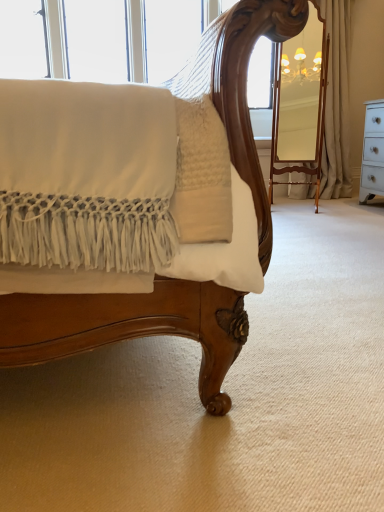
Measure the distance between beige fabric curtain at upper right, the second curtain when ordered from right to left, and camera.

beige fabric curtain at upper right, the second curtain when ordered from right to left, is 3.27 meters away from camera.

You are a GUI agent. You are given a task and a screenshot of the screen. Output one action in this format:
    pyautogui.click(x=<x>, y=<y>)
    Task: Click on the beige fabric curtain at upper right, the 1th curtain positioned from the left
    
    Given the screenshot: What is the action you would take?
    pyautogui.click(x=337, y=102)

Describe the element at coordinates (337, 102) in the screenshot. I see `beige fabric curtain at upper right, the 1th curtain positioned from the left` at that location.

Measure the distance between beige fabric curtain at right, marked as the first curtain in a right-to-left arrangement, and camera.

beige fabric curtain at right, marked as the first curtain in a right-to-left arrangement, is 3.72 meters from camera.

Locate an element on the screen. beige fabric curtain at right, marked as the first curtain in a right-to-left arrangement is located at coordinates (337, 103).

Image resolution: width=384 pixels, height=512 pixels. Describe the element at coordinates (337, 103) in the screenshot. I see `beige fabric curtain at right, marked as the first curtain in a right-to-left arrangement` at that location.

You are a GUI agent. You are given a task and a screenshot of the screen. Output one action in this format:
    pyautogui.click(x=<x>, y=<y>)
    Task: Click on the beige fabric curtain at upper right, the second curtain when ordered from right to left
    
    Given the screenshot: What is the action you would take?
    pyautogui.click(x=337, y=102)

Is beige fabric curtain at upper right, the 1th curtain positioned from the left, to the left or to the right of beige fabric curtain at right, the second curtain when ordered from left to right, in the image?

beige fabric curtain at upper right, the 1th curtain positioned from the left, is positioned on beige fabric curtain at right, the second curtain when ordered from left to right,'s left side.

Which is behind, beige fabric curtain at upper right, the second curtain when ordered from right to left, or beige fabric curtain at right, the second curtain when ordered from left to right?

beige fabric curtain at right, the second curtain when ordered from left to right, is further from the camera.

Does point (338, 12) come farther from viewer compared to point (332, 40)?

Yes, point (338, 12) is behind point (332, 40).

From the image's perspective, who appears lower, beige fabric curtain at upper right, the 1th curtain positioned from the left, or beige fabric curtain at right, the second curtain when ordered from left to right?

beige fabric curtain at upper right, the 1th curtain positioned from the left, is shown below in the image.

From a real-world perspective, which object stands above the other?

beige fabric curtain at right, marked as the first curtain in a right-to-left arrangement, from a real-world perspective.

Between beige fabric curtain at upper right, the 1th curtain positioned from the left, and beige fabric curtain at right, marked as the first curtain in a right-to-left arrangement, which one has larger width?

With larger width is beige fabric curtain at upper right, the 1th curtain positioned from the left.

Does beige fabric curtain at upper right, the 1th curtain positioned from the left, have a greater height compared to beige fabric curtain at right, marked as the first curtain in a right-to-left arrangement?

No.

Between beige fabric curtain at upper right, the 1th curtain positioned from the left, and beige fabric curtain at right, marked as the first curtain in a right-to-left arrangement, which one has larger size?

With larger size is beige fabric curtain at upper right, the 1th curtain positioned from the left.

Is beige fabric curtain at right, marked as the first curtain in a right-to-left arrangement, a part of beige fabric curtain at upper right, the second curtain when ordered from right to left?

No, beige fabric curtain at upper right, the second curtain when ordered from right to left, does not contain beige fabric curtain at right, marked as the first curtain in a right-to-left arrangement.

Are beige fabric curtain at upper right, the second curtain when ordered from right to left, and beige fabric curtain at right, the second curtain when ordered from left to right, beside each other?

Absolutely, beige fabric curtain at upper right, the second curtain when ordered from right to left, is next to and touching beige fabric curtain at right, the second curtain when ordered from left to right.

Could you tell me if beige fabric curtain at upper right, the 1th curtain positioned from the left, is facing beige fabric curtain at right, the second curtain when ordered from left to right?

No, beige fabric curtain at upper right, the 1th curtain positioned from the left, is not aimed at beige fabric curtain at right, the second curtain when ordered from left to right.

Locate an element on the screen. The width and height of the screenshot is (384, 512). curtain behind the beige fabric curtain at upper right, the 1th curtain positioned from the left is located at coordinates (337, 103).

Consider the image. Considering the relative positions of beige fabric curtain at right, the second curtain when ordered from left to right, and beige fabric curtain at upper right, the 1th curtain positioned from the left, in the image provided, is beige fabric curtain at right, the second curtain when ordered from left to right, to the left or to the right of beige fabric curtain at upper right, the 1th curtain positioned from the left,?

Clearly, beige fabric curtain at right, the second curtain when ordered from left to right, is on the right of beige fabric curtain at upper right, the 1th curtain positioned from the left, in the image.

Is beige fabric curtain at right, the second curtain when ordered from left to right, further to the viewer compared to beige fabric curtain at upper right, the second curtain when ordered from right to left?

Answer: Yes.

Considering the points (322, 3) and (339, 121), which point is behind, point (322, 3) or point (339, 121)?

The point (339, 121) is farther.

Based on the photo, from the image's perspective, relative to beige fabric curtain at upper right, the 1th curtain positioned from the left, is beige fabric curtain at right, the second curtain when ordered from left to right, above or below?

beige fabric curtain at right, the second curtain when ordered from left to right, is above beige fabric curtain at upper right, the 1th curtain positioned from the left.

From a real-world perspective, which object stands above the other?

From a 3D spatial view, beige fabric curtain at right, marked as the first curtain in a right-to-left arrangement, is above.

Is beige fabric curtain at right, marked as the first curtain in a right-to-left arrangement, wider than beige fabric curtain at upper right, the 1th curtain positioned from the left?

No, beige fabric curtain at right, marked as the first curtain in a right-to-left arrangement, is not wider than beige fabric curtain at upper right, the 1th curtain positioned from the left.

Can you confirm if beige fabric curtain at right, marked as the first curtain in a right-to-left arrangement, is shorter than beige fabric curtain at upper right, the 1th curtain positioned from the left?

Incorrect, the height of beige fabric curtain at right, marked as the first curtain in a right-to-left arrangement, does not fall short of that of beige fabric curtain at upper right, the 1th curtain positioned from the left.

Can you confirm if beige fabric curtain at right, the second curtain when ordered from left to right, is smaller than beige fabric curtain at upper right, the 1th curtain positioned from the left?

Yes.

Is beige fabric curtain at right, marked as the first curtain in a right-to-left arrangement, inside the boundaries of beige fabric curtain at upper right, the second curtain when ordered from right to left, or outside?

beige fabric curtain at right, marked as the first curtain in a right-to-left arrangement, is spatially situated outside beige fabric curtain at upper right, the second curtain when ordered from right to left.

Does beige fabric curtain at right, marked as the first curtain in a right-to-left arrangement, touch beige fabric curtain at upper right, the 1th curtain positioned from the left?

Yes, beige fabric curtain at right, marked as the first curtain in a right-to-left arrangement, is beside beige fabric curtain at upper right, the 1th curtain positioned from the left.

Does beige fabric curtain at right, marked as the first curtain in a right-to-left arrangement, turn towards beige fabric curtain at upper right, the second curtain when ordered from right to left?

No, beige fabric curtain at right, marked as the first curtain in a right-to-left arrangement, is not oriented towards beige fabric curtain at upper right, the second curtain when ordered from right to left.

Locate an element on the screen. The width and height of the screenshot is (384, 512). curtain in front of the beige fabric curtain at right, the second curtain when ordered from left to right is located at coordinates 337,102.

Locate an element on the screen. curtain on the left of the beige fabric curtain at right, marked as the first curtain in a right-to-left arrangement is located at coordinates (337, 102).

What are the coordinates of `curtain located above the beige fabric curtain at upper right, the second curtain when ordered from right to left (from the image's perspective)` in the screenshot? It's located at (337, 103).